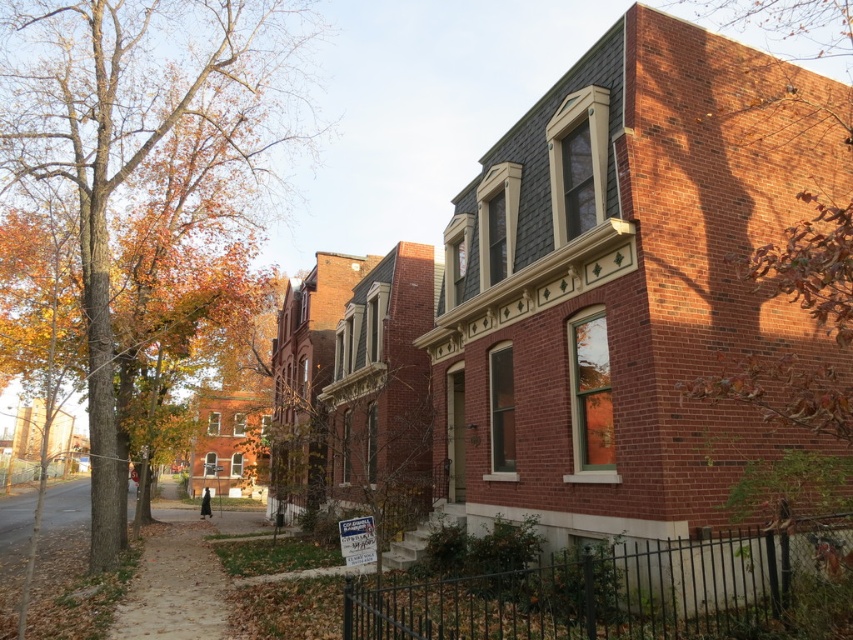
You are a gardener who wants to place a new bench between the autumn leaves at left and the brown leafy tree at right. Given that the bench requires 2 meters of space, can the available space between them accommodate the bench?

The autumn leaves at left is narrower than the brown leafy tree at right, but the exact distance between them isn not specified. However, since the leaves are at the left and the tree is at the right, there might be enough space. Without precise measurements, it is uncertain if the 2 meters required for the bench can be accommodated.

You are a pedestrian walking on the sidewalk and see autumn leaves at left and brown dirt pavement at lower left. Which surface is covering the other?

The autumn leaves at left are positioned over the brown dirt pavement at lower left, meaning the leaves are covering the pavement.